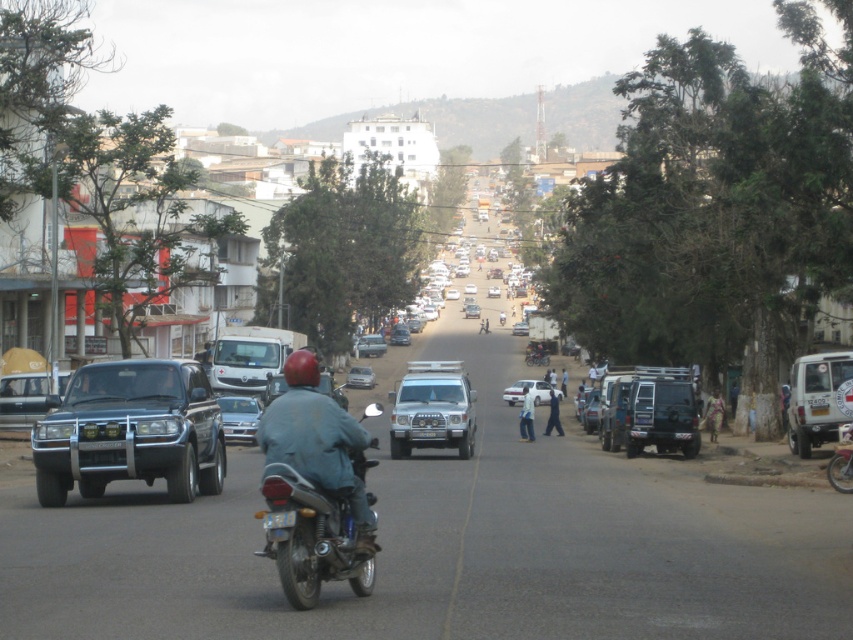
Question: Can you confirm if satin silver suv at center is positioned to the right of white matte van at right?

Choices:
 (A) no
 (B) yes

Answer: (A)

Question: Which object is farther from the camera taking this photo?

Choices:
 (A) matte black suv at left
 (B) silver metallic sedan at center
 (C) matte black suv at right
 (D) black plastic license plate at center

Answer: (B)

Question: Which point is farther to the camera?

Choices:
 (A) metallic silver motorcycle at center
 (B) matte black suv at right
 (C) light brown fabric dress at lower right

Answer: (C)

Question: Which object is farther from the camera taking this photo?

Choices:
 (A) metallic silver car at center
 (B) blue fabric pants at center
 (C) white plastic license plate at center
 (D) black plastic license plate at center

Answer: (B)

Question: From the image, what is the correct spatial relationship of metallic blue truck at left in relation to light brown fabric dress at lower right?

Choices:
 (A) below
 (B) above

Answer: (B)

Question: Is white matte van at right to the right of white fabric shirt at center from the viewer's perspective?

Choices:
 (A) yes
 (B) no

Answer: (A)